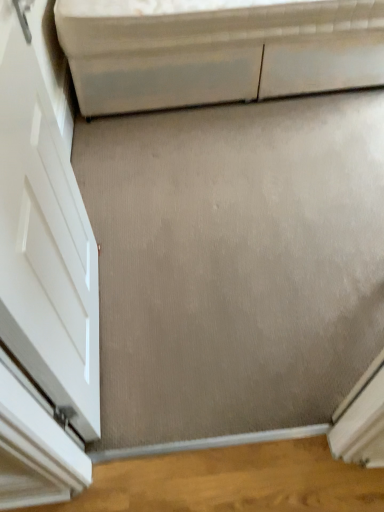
The height and width of the screenshot is (512, 384). Describe the element at coordinates (217, 51) in the screenshot. I see `white glossy cabinet at upper center` at that location.

Locate an element on the screen. white glossy cabinet at upper center is located at coordinates (217, 51).

This screenshot has height=512, width=384. Identify the location of white glossy door at left. (43, 272).

Describe the element at coordinates (43, 272) in the screenshot. I see `white glossy door at left` at that location.

What are the coordinates of `white glossy cabinet at upper center` in the screenshot? It's located at (217, 51).

Does white glossy door at left appear on the left side of white glossy cabinet at upper center?

Indeed, white glossy door at left is positioned on the left side of white glossy cabinet at upper center.

Which object is closer to the camera, white glossy door at left or white glossy cabinet at upper center?

white glossy door at left.

Considering the positions of points (37, 251) and (241, 14), is point (37, 251) closer to camera compared to point (241, 14)?

Yes, it is.

In the scene shown: From the image's perspective, does white glossy door at left appear higher than white glossy cabinet at upper center?

Actually, white glossy door at left appears below white glossy cabinet at upper center in the image.

From a real-world perspective, is white glossy door at left under white glossy cabinet at upper center?

Incorrect, from a real-world perspective, white glossy door at left is higher than white glossy cabinet at upper center.

In the scene shown: Does white glossy door at left have a greater width compared to white glossy cabinet at upper center?

No, white glossy door at left is not wider than white glossy cabinet at upper center.

Can you confirm if white glossy door at left is shorter than white glossy cabinet at upper center?

No.

Consider the image. Which of these two, white glossy door at left or white glossy cabinet at upper center, is bigger?

white glossy cabinet at upper center.

Would you say white glossy door at left contains white glossy cabinet at upper center?

No.

Are white glossy door at left and white glossy cabinet at upper center making contact?

No, white glossy door at left is not next to white glossy cabinet at upper center.

Looking at this image, is white glossy cabinet at upper center at the back of white glossy door at left?

white glossy door at left does not have its back to white glossy cabinet at upper center.

How distant is white glossy door at left from white glossy cabinet at upper center?

white glossy door at left and white glossy cabinet at upper center are 1.29 meters apart.

Image resolution: width=384 pixels, height=512 pixels. Find the location of `door above the white glossy cabinet at upper center (from a real-world perspective)`. door above the white glossy cabinet at upper center (from a real-world perspective) is located at coordinates (43, 272).

Between white glossy cabinet at upper center and white glossy door at left, which one appears on the left side from the viewer's perspective?

From the viewer's perspective, white glossy door at left appears more on the left side.

Consider the image. Is white glossy cabinet at upper center behind white glossy door at left?

Yes, white glossy cabinet at upper center is further from the viewer.

Which is less distant, (281, 81) or (86, 252)?

A: Point (281, 81) is farther from the camera than point (86, 252).

From the image's perspective, would you say white glossy cabinet at upper center is positioned over white glossy door at left?

Yes, from the image's perspective, white glossy cabinet at upper center is over white glossy door at left.

From a real-world perspective, which object rests below the other?

white glossy cabinet at upper center is physically lower.

Which object is wider, white glossy cabinet at upper center or white glossy door at left?

Wider between the two is white glossy cabinet at upper center.

Considering the sizes of objects white glossy cabinet at upper center and white glossy door at left in the image provided, who is taller, white glossy cabinet at upper center or white glossy door at left?

white glossy door at left is taller.

Can you confirm if white glossy cabinet at upper center is bigger than white glossy door at left?

Yes, white glossy cabinet at upper center is bigger than white glossy door at left.

Would you say white glossy cabinet at upper center is inside or outside white glossy door at left?

white glossy cabinet at upper center is spatially situated outside white glossy door at left.

Based on the photo, would you say white glossy cabinet at upper center is a long distance from white glossy door at left?

Yes, white glossy cabinet at upper center and white glossy door at left are located far from each other.

Is white glossy cabinet at upper center aimed at white glossy door at left?

No, white glossy cabinet at upper center is not facing towards white glossy door at left.

The image size is (384, 512). I want to click on furniture directly beneath the white glossy door at left (from a real-world perspective), so click(x=217, y=51).

Where is `door that is in front of the white glossy cabinet at upper center`? The height and width of the screenshot is (512, 384). door that is in front of the white glossy cabinet at upper center is located at coordinates (43, 272).

Image resolution: width=384 pixels, height=512 pixels. Identify the location of furniture on the right of white glossy door at left. (217, 51).